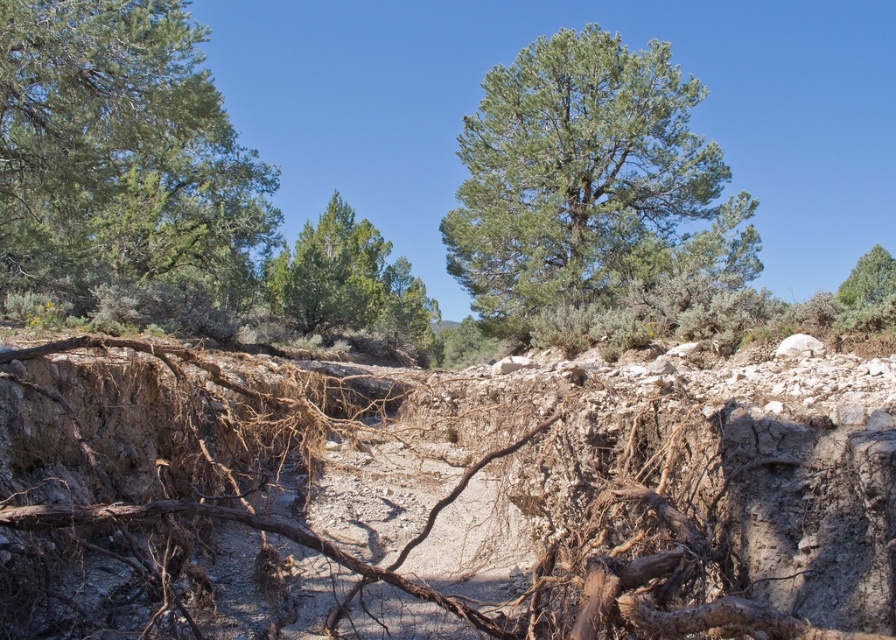
Which of these two, green leafy tree at center or green leafy tree at upper right, stands shorter?

Standing shorter between the two is green leafy tree at upper right.

Is point (464, 124) positioned after point (846, 280)?

No, it is not.

Locate an element on the screen. This screenshot has width=896, height=640. green leafy tree at center is located at coordinates (587, 180).

Locate an element on the screen. The image size is (896, 640). green leafy tree at center is located at coordinates (587, 180).

Does point (246, 248) lie in front of point (664, 225)?

No, (246, 248) is behind (664, 225).

Which of these two, green needle-like at upper left or green leafy tree at center, stands taller?

green leafy tree at center

This screenshot has width=896, height=640. Describe the element at coordinates (119, 156) in the screenshot. I see `green needle-like at upper left` at that location.

Image resolution: width=896 pixels, height=640 pixels. What are the coordinates of `green needle-like at upper left` in the screenshot? It's located at (119, 156).

Does green needle-like at upper left have a smaller size compared to green leafy tree at upper right?

Correct, green needle-like at upper left occupies less space than green leafy tree at upper right.

Does green needle-like at upper left appear on the right side of green leafy tree at upper right?

In fact, green needle-like at upper left is to the left of green leafy tree at upper right.

You are a GUI agent. You are given a task and a screenshot of the screen. Output one action in this format:
    pyautogui.click(x=<x>, y=<y>)
    Task: Click on the green needle-like at upper left
    This screenshot has width=896, height=640.
    Given the screenshot: What is the action you would take?
    pyautogui.click(x=119, y=156)